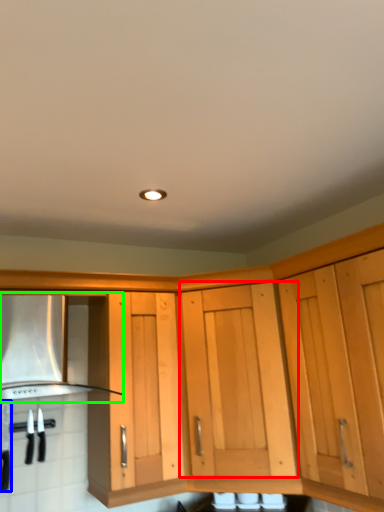
Question: Considering the real-world distances, which object is closest to cabinetry (highlighted by a red box)? kitchen appliance (highlighted by a blue box) or vent (highlighted by a green box).

Choices:
 (A) kitchen appliance
 (B) vent

Answer: (B)